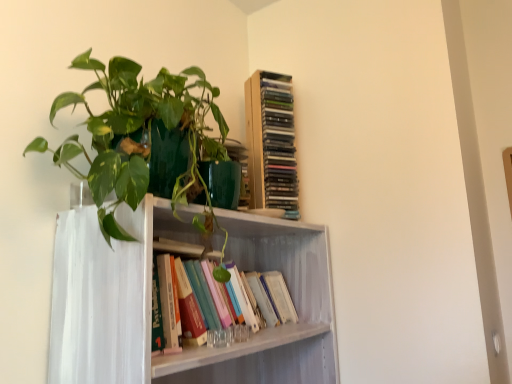
Question: Which direction should I rotate to look at wooden cd tower at upper center, the second book ordered from the bottom, — up or down?

Choices:
 (A) up
 (B) down

Answer: (A)

Question: Is wooden cd tower at upper center, the second book ordered from the bottom, not near white painted wood shelf at center?

Choices:
 (A) no
 (B) yes

Answer: (A)

Question: Considering the relative sizes of wooden cd tower at upper center, the second book ordered from the bottom, and white painted wood shelf at center in the image provided, is wooden cd tower at upper center, the second book ordered from the bottom, wider than white painted wood shelf at center?

Choices:
 (A) yes
 (B) no

Answer: (B)

Question: Could you tell me if wooden cd tower at upper center, the first book in the top-to-bottom sequence, is turned towards white painted wood shelf at center?

Choices:
 (A) yes
 (B) no

Answer: (B)

Question: Would you say wooden cd tower at upper center, the second book ordered from the bottom, is outside white painted wood shelf at center?

Choices:
 (A) yes
 (B) no

Answer: (A)

Question: Does wooden cd tower at upper center, the second book ordered from the bottom, appear on the left side of white painted wood shelf at center?

Choices:
 (A) no
 (B) yes

Answer: (A)

Question: From the image's perspective, is wooden cd tower at upper center, the second book ordered from the bottom, below white painted wood shelf at center?

Choices:
 (A) no
 (B) yes

Answer: (A)

Question: Does green glossy plant at upper left have a lesser height compared to hardcover books at center, which is the first book from bottom to top?

Choices:
 (A) no
 (B) yes

Answer: (A)

Question: Considering the relative positions of green glossy plant at upper left and hardcover books at center, the 2th book in the top-to-bottom sequence, in the image provided, is green glossy plant at upper left behind hardcover books at center, the 2th book in the top-to-bottom sequence,?

Choices:
 (A) yes
 (B) no

Answer: (B)

Question: Can you confirm if green glossy plant at upper left is positioned to the left of hardcover books at center, the 2th book in the top-to-bottom sequence?

Choices:
 (A) yes
 (B) no

Answer: (A)

Question: From the image's perspective, is green glossy plant at upper left beneath hardcover books at center, which is the first book from bottom to top?

Choices:
 (A) yes
 (B) no

Answer: (B)

Question: Can you confirm if green glossy plant at upper left is thinner than hardcover books at center, which is the first book from bottom to top?

Choices:
 (A) no
 (B) yes

Answer: (A)

Question: Does green glossy plant at upper left come in front of hardcover books at center, which is the first book from bottom to top?

Choices:
 (A) no
 (B) yes

Answer: (B)

Question: Is green glossy plant at upper left not within wooden cd tower at upper center, the second book ordered from the bottom?

Choices:
 (A) no
 (B) yes

Answer: (B)